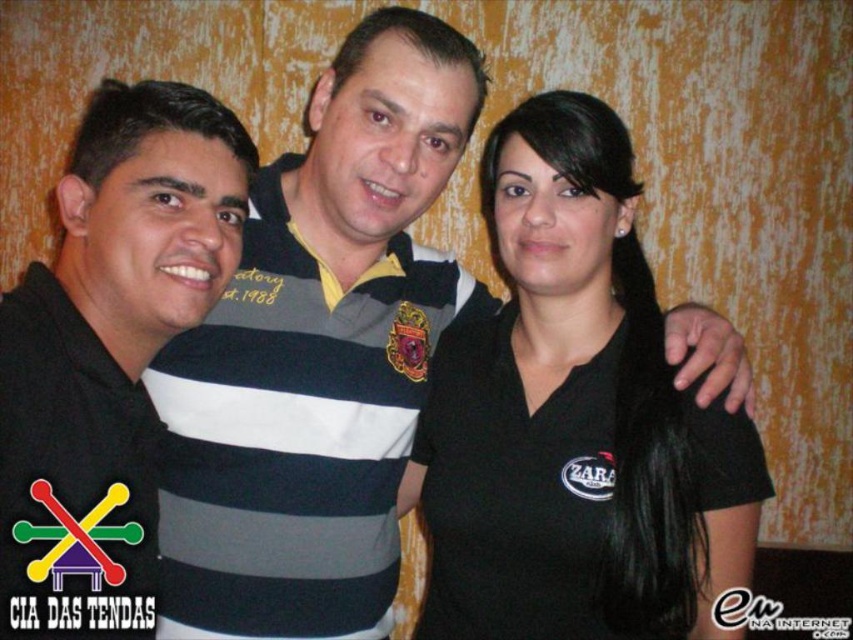
You are holding a camera and want to take a photo of the scene. The camera is currently 1.17 meters away from the point at coordinates point (608,461). If you move the camera 0.5 meters closer to this point, will the subjects in the photo appear larger or smaller?

Moving the camera 0.5 meters closer to the point (608,461) reduces the distance from 1.17 meters to 0.67 meters. Since decreasing the distance between the camera and the subject generally makes the subjects appear larger in the photo, the subjects will appear larger.

Looking at this image, you are a photographer trying to capture a group photo. You notice two shirts in the center of the image, a black matte shirt at center and a striped cotton polo shirt at center. Which shirt is narrower?

The black matte shirt at center is narrower than the striped cotton polo shirt at center.

Looking at this image, you are standing in front of the group photo and want to know which of the two points, point (685,433) or point (67,356), is closer to you. Can you determine this based on their positions in the image?

Point (685,433) is further to the viewer than point (67,356), so the closer point to you is point (67,356).